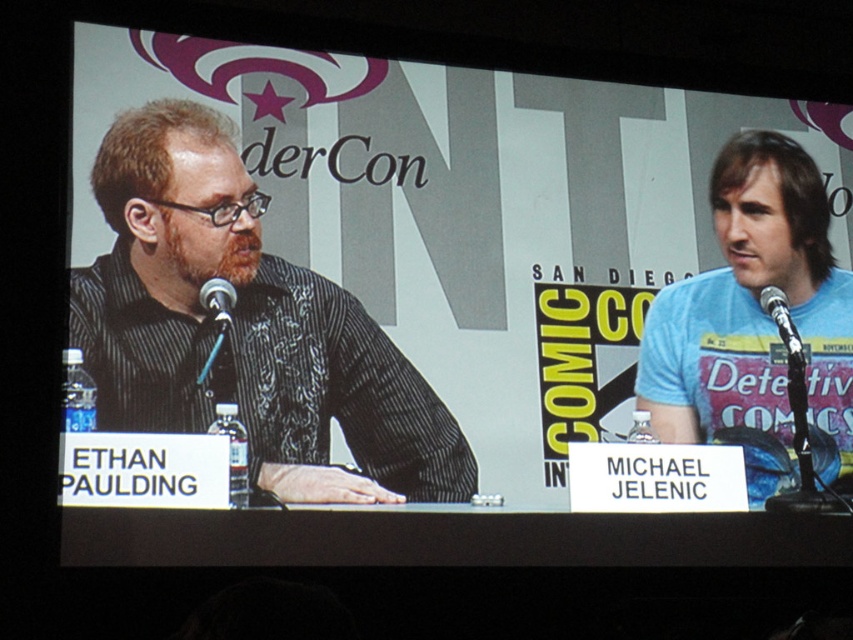
Does matte black shirt at left have a greater height compared to light blue t-shirt at right?

Correct, matte black shirt at left is much taller as light blue t-shirt at right.

Between matte black shirt at left and light blue t-shirt at right, which one appears on the left side from the viewer's perspective?

matte black shirt at left is more to the left.

Which is behind, point (428, 209) or point (782, 236)?

Point (782, 236)

The width and height of the screenshot is (853, 640). Identify the location of matte black shirt at left. 467,212.

Measure the distance between light blue t-shirt at right and camera.

light blue t-shirt at right and camera are 10.38 meters apart.

Is light blue t-shirt at right to the left of black plastic microphone at left from the viewer's perspective?

In fact, light blue t-shirt at right is to the right of black plastic microphone at left.

What do you see at coordinates (755, 321) in the screenshot? This screenshot has width=853, height=640. I see `light blue t-shirt at right` at bounding box center [755, 321].

This screenshot has height=640, width=853. Identify the location of light blue t-shirt at right. (755, 321).

Can you confirm if black textured shirt at left is positioned to the right of light blue t-shirt at right?

Incorrect, black textured shirt at left is not on the right side of light blue t-shirt at right.

Is black textured shirt at left to the left of light blue t-shirt at right from the viewer's perspective?

Yes, black textured shirt at left is to the left of light blue t-shirt at right.

Which is behind, point (114, 420) or point (758, 436)?

The point (758, 436) is behind.

In order to click on black textured shirt at left in this screenshot , I will do `click(245, 326)`.